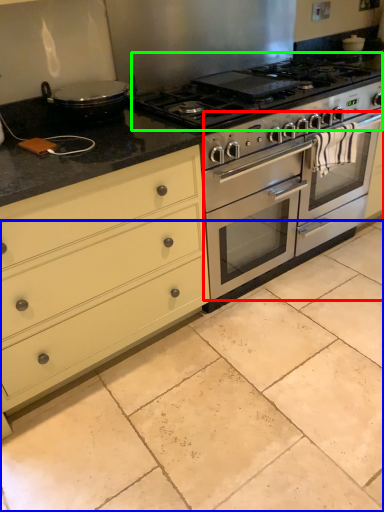
Question: Considering the real-world distances, which object is closest to oven (highlighted by a red box)? ceramic tile (highlighted by a blue box) or gas stove (highlighted by a green box).

Choices:
 (A) ceramic tile
 (B) gas stove

Answer: (B)